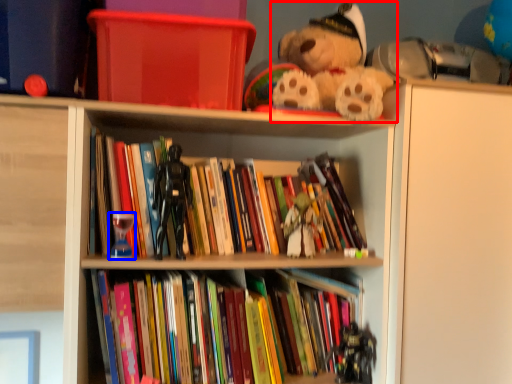
Question: Which point is closer to the camera, teddy bear (highlighted by a red box) or toy (highlighted by a blue box)?

Choices:
 (A) teddy bear
 (B) toy

Answer: (A)